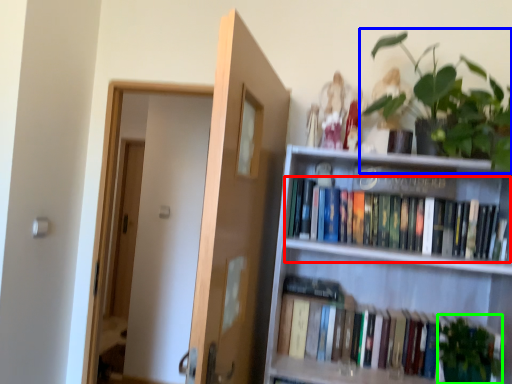
Question: Estimate the real-world distances between objects in this image. Which object is farther from book (highlighted by a red box), houseplant (highlighted by a blue box) or plant (highlighted by a green box)?

Choices:
 (A) houseplant
 (B) plant

Answer: (B)